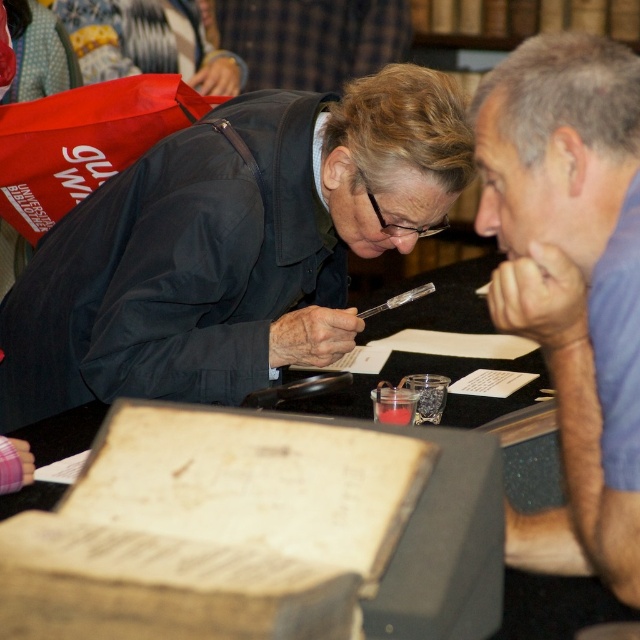
Between dark gray jacket at upper left and blue cotton shirt at upper right, which one has less height?

blue cotton shirt at upper right is shorter.

Is dark gray jacket at upper left positioned in front of blue cotton shirt at upper right?

No, it is behind blue cotton shirt at upper right.

Does point (56, 272) come behind point (508, 115)?

That is True.

This screenshot has width=640, height=640. In order to click on dark gray jacket at upper left in this screenshot , I will do `click(230, 246)`.